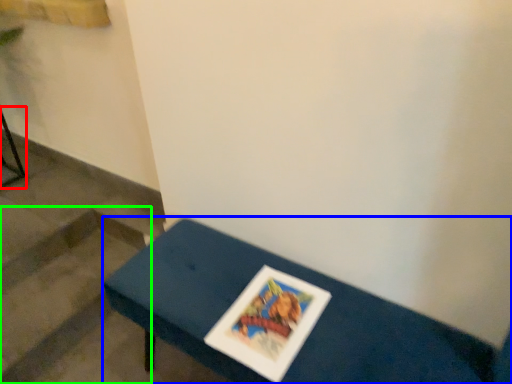
Question: Which object is the farthest from furniture (highlighted by a red box)? Choose among these: table (highlighted by a blue box) or stairwell (highlighted by a green box).

Choices:
 (A) table
 (B) stairwell

Answer: (A)